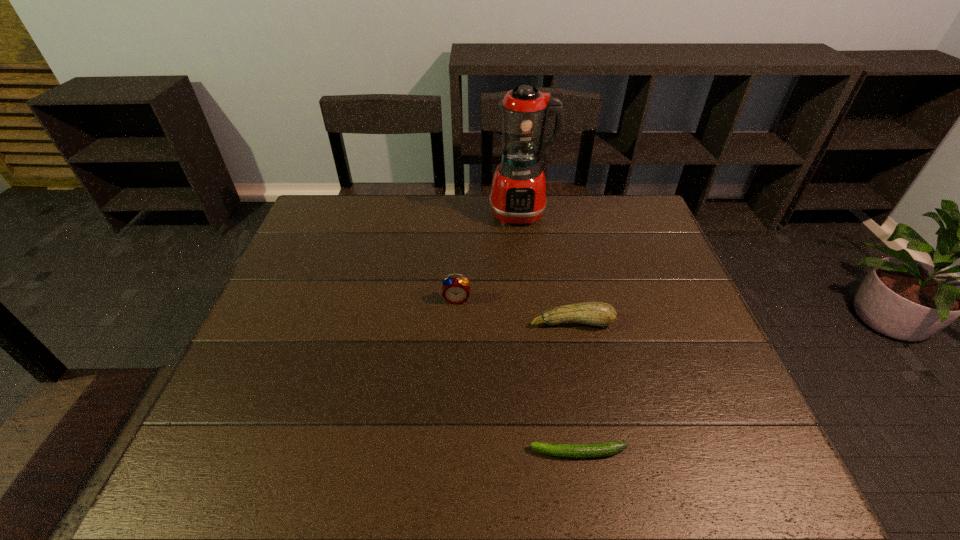
I want to click on vacant space that is in between the tallest object and the taller zucchini, so click(546, 268).

Find the location of a particular element. This screenshot has height=540, width=960. vacant point located between the tallest object and the nearer zucchini is located at coordinates (549, 333).

Locate which object is the closest to the taller zucchini. Please provide its 2D coordinates. Your answer should be formatted as a tuple, i.e. [(x, y)], where the tuple contains the x and y coordinates of a point satisfying the conditions above.

[(455, 290)]

Locate which object is the third closest to the tallest object. Please provide its 2D coordinates. Your answer should be formatted as a tuple, i.e. [(x, y)], where the tuple contains the x and y coordinates of a point satisfying the conditions above.

[(608, 448)]

This screenshot has width=960, height=540. Find the location of `free spot that satisfies the following two spatial constraints: 1. at the stem end of the second nearest object; 2. on the front-facing side of the nearer zucchini`. free spot that satisfies the following two spatial constraints: 1. at the stem end of the second nearest object; 2. on the front-facing side of the nearer zucchini is located at coordinates (598, 453).

The width and height of the screenshot is (960, 540). Identify the location of free location that satisfies the following two spatial constraints: 1. at the stem end of the third tallest object; 2. on the front-facing side of the nearer zucchini. (598, 453).

This screenshot has width=960, height=540. I want to click on vacant region that satisfies the following two spatial constraints: 1. at the stem end of the third tallest object; 2. on the front-facing side of the shorter zucchini, so point(598,453).

This screenshot has width=960, height=540. What are the coordinates of `vacant space that satisfies the following two spatial constraints: 1. at the stem end of the third farthest object; 2. on the front-facing side of the nearer zucchini` in the screenshot? It's located at (598, 453).